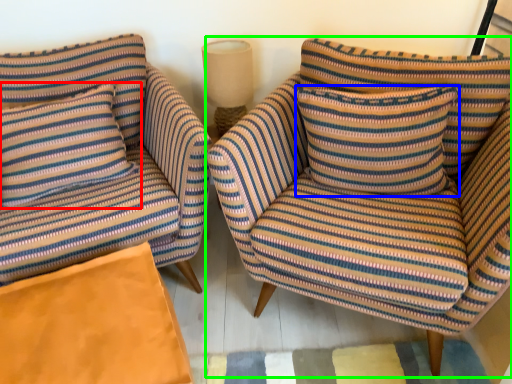
Question: Based on their relative distances, which object is farther from pillow (highlighted by a red box)? Choose from pillow (highlighted by a blue box) and chair (highlighted by a green box).

Choices:
 (A) pillow
 (B) chair

Answer: (A)